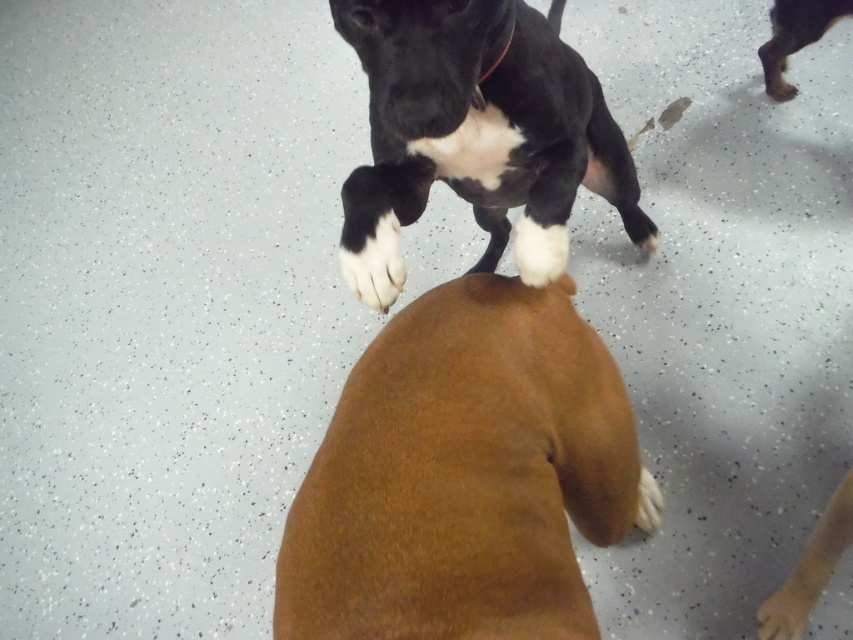
Where is `white matte paw at center`? The width and height of the screenshot is (853, 640). white matte paw at center is located at coordinates (375, 266).

The image size is (853, 640). What do you see at coordinates (375, 266) in the screenshot?
I see `white matte paw at center` at bounding box center [375, 266].

Locate an element on the screen. This screenshot has height=640, width=853. white matte paw at center is located at coordinates pos(375,266).

Can you confirm if brown furry dog at center is thinner than white fur at lower center?

Incorrect, brown furry dog at center's width is not less than white fur at lower center's.

Does point (555, 358) come behind point (653, 502)?

That is False.

Between point (558, 636) and point (651, 492), which one is positioned behind?

Positioned behind is point (651, 492).

The height and width of the screenshot is (640, 853). What are the coordinates of `brown furry dog at center` in the screenshot? It's located at (463, 476).

Between white matte paw at upper center and brown furry paw at lower right, which one has less height?

brown furry paw at lower right

Does point (524, 241) lie in front of point (795, 625)?

Yes, point (524, 241) is in front of point (795, 625).

What do you see at coordinates (538, 250) in the screenshot? The width and height of the screenshot is (853, 640). I see `white matte paw at upper center` at bounding box center [538, 250].

Where is `white matte paw at upper center`? This screenshot has width=853, height=640. white matte paw at upper center is located at coordinates (538, 250).